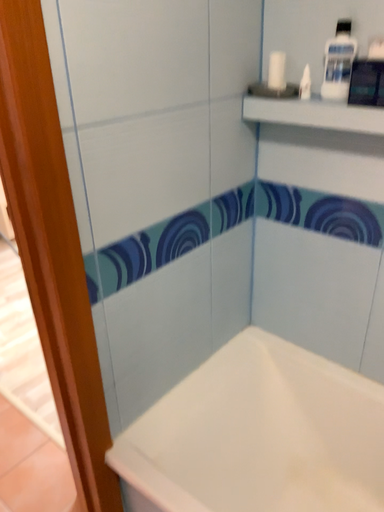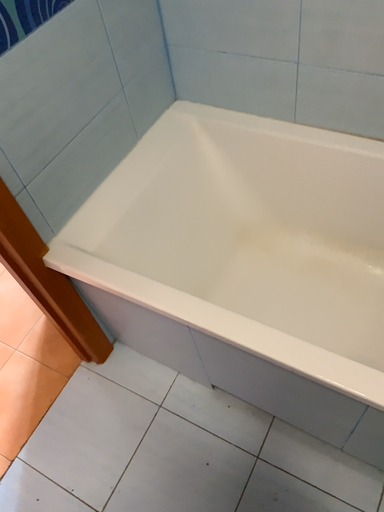
Question: Which way did the camera rotate in the video?

Choices:
 (A) rotated downward
 (B) rotated upward

Answer: (A)